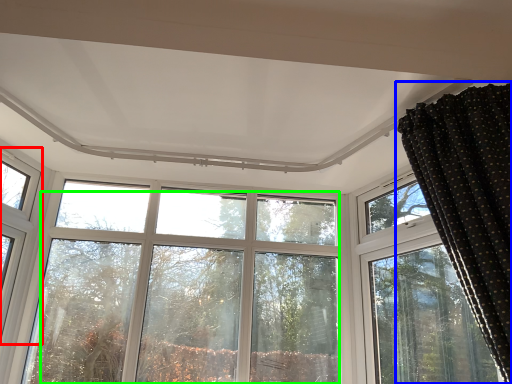
Question: Which is farther away from window (highlighted by a red box)? curtain (highlighted by a blue box) or tree (highlighted by a green box)?

Choices:
 (A) curtain
 (B) tree

Answer: (A)